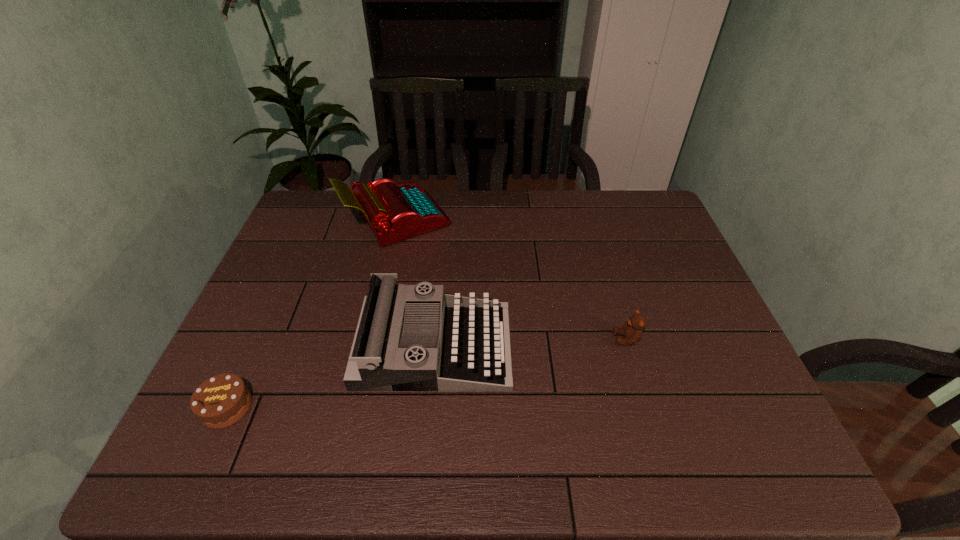
At what (x,y) coordinates should I click in order to perform the action: click on the tallest object. Please return your answer as a coordinate pair (x, y). Looking at the image, I should click on (394, 212).

You are a GUI agent. You are given a task and a screenshot of the screen. Output one action in this format:
    pyautogui.click(x=<x>, y=<y>)
    Task: Click on the farther typewriter
    The width and height of the screenshot is (960, 540).
    Given the screenshot: What is the action you would take?
    pyautogui.click(x=394, y=212)

The width and height of the screenshot is (960, 540). I want to click on the third shortest object, so click(409, 337).

You are a GUI agent. You are given a task and a screenshot of the screen. Output one action in this format:
    pyautogui.click(x=<x>, y=<y>)
    Task: Click on the shorter typewriter
    Image resolution: width=960 pixels, height=540 pixels.
    Given the screenshot: What is the action you would take?
    pyautogui.click(x=409, y=337)

This screenshot has height=540, width=960. Identify the location of the rightmost object. [632, 330].

At what (x,y) coordinates should I click in order to perform the action: click on the leftmost object. Please return your answer as a coordinate pair (x, y). Looking at the image, I should click on point(222,400).

The height and width of the screenshot is (540, 960). Find the location of `blank area located 0.310m on the typing side of the farthest object`. blank area located 0.310m on the typing side of the farthest object is located at coordinates (545, 220).

This screenshot has height=540, width=960. In order to click on free space located on the typing side of the third shortest object in this screenshot , I will do `click(559, 346)`.

Locate an element on the screen. This screenshot has width=960, height=540. vacant region located 0.080m on the face of the teddy bear is located at coordinates pos(582,339).

The image size is (960, 540). Identify the location of vacant region located 0.370m on the face of the teddy bear. (466, 339).